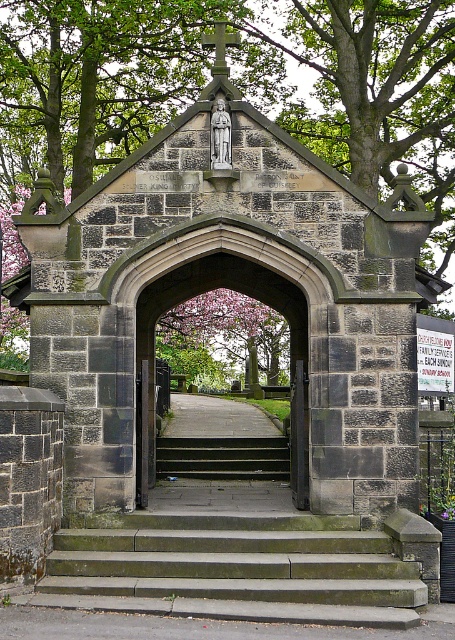
Consider the image. You are standing in front of the stone archway and want to walk down the stairs. Which object is closer to you, the dark stone archway at center or the dark gray concrete stairs at center?

The dark stone archway at center is closer to the viewer than the dark gray concrete stairs at center, so the dark stone archway at center is closer to you.